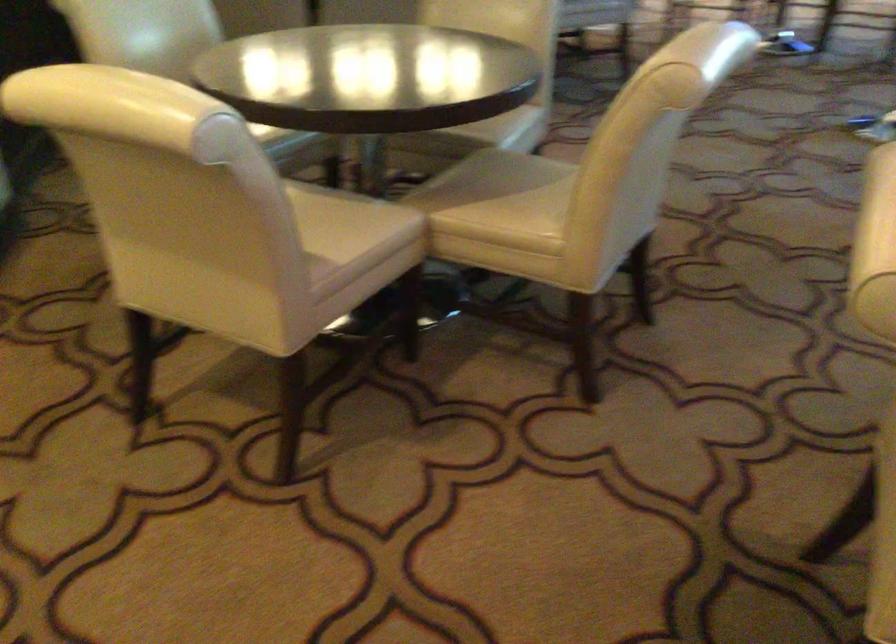
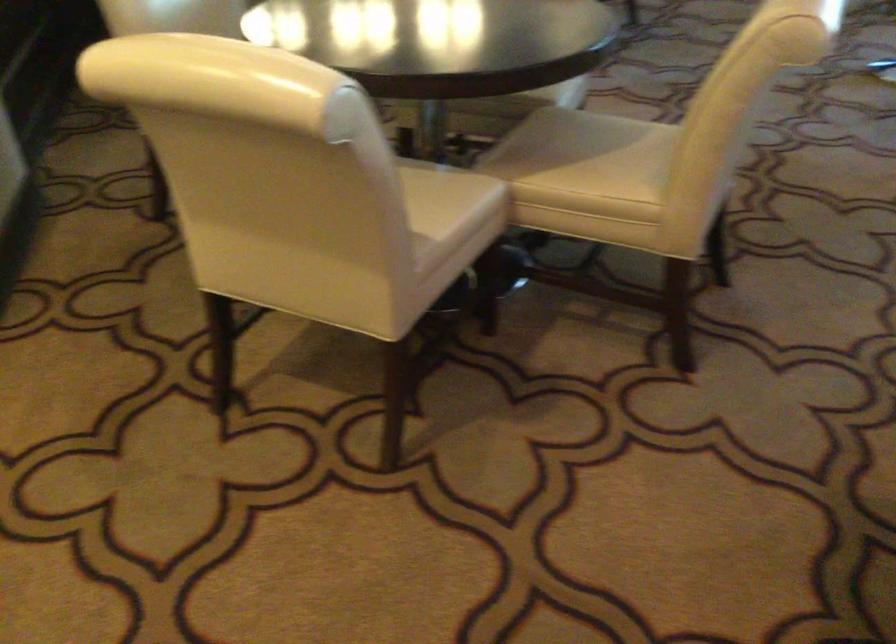
Where in the second image is the point corresponding to point 530,184 from the first image?

(613, 144)